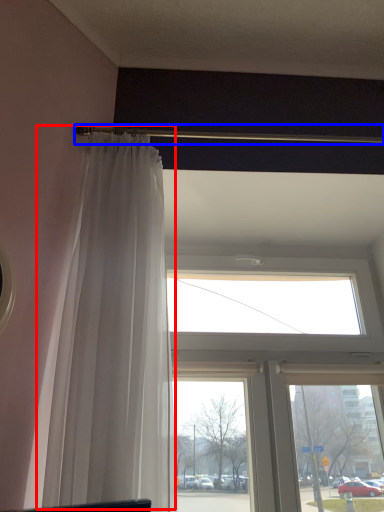
Question: Which object appears farthest to the camera in this image, curtain (highlighted by a red box) or beam (highlighted by a blue box)?

Choices:
 (A) curtain
 (B) beam

Answer: (B)